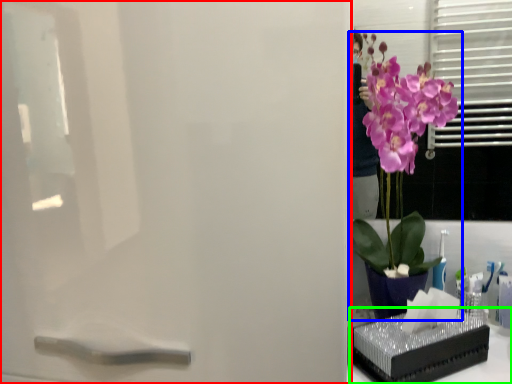
Question: Estimate the real-world distances between objects in this image. Which object is farther from screen door (highlighted by a red box), houseplant (highlighted by a blue box) or window sill (highlighted by a green box)?

Choices:
 (A) houseplant
 (B) window sill

Answer: (B)